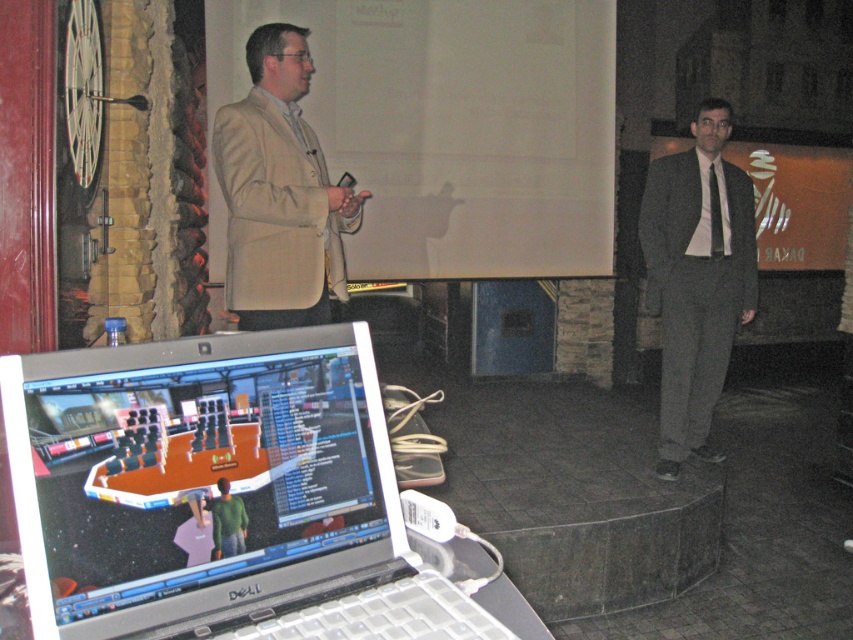
Does beige fabric suit at upper left have a larger size compared to black striped tie at right?

Indeed, beige fabric suit at upper left has a larger size compared to black striped tie at right.

In the scene shown: Who is lower down, beige fabric suit at upper left or black striped tie at right?

beige fabric suit at upper left

Looking at this image, measure the distance between point (241,317) and camera.

They are 2.54 meters apart.

Locate an element on the screen. This screenshot has width=853, height=640. beige fabric suit at upper left is located at coordinates (279, 193).

Can you confirm if white matte projection screen at upper center is smaller than black striped tie at right?

No.

Can you confirm if white matte projection screen at upper center is positioned above black striped tie at right?

Correct, white matte projection screen at upper center is located above black striped tie at right.

Is point (383, 276) behind point (717, 212)?

Yes, it is.

This screenshot has width=853, height=640. I want to click on white matte projection screen at upper center, so [x=451, y=125].

Identify the location of beige fabric suit at upper left. [279, 193].

Can you confirm if beige fabric suit at upper left is shorter than dark gray suit at right?

Yes, beige fabric suit at upper left is shorter than dark gray suit at right.

Image resolution: width=853 pixels, height=640 pixels. Describe the element at coordinates (279, 193) in the screenshot. I see `beige fabric suit at upper left` at that location.

The image size is (853, 640). I want to click on beige fabric suit at upper left, so click(x=279, y=193).